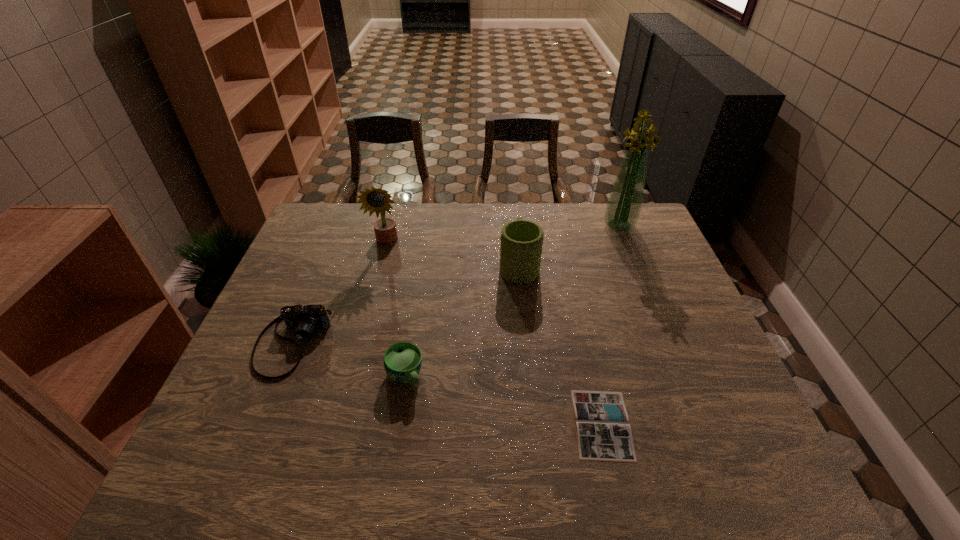
At what (x,y) coordinates should I click in order to perform the action: click on free space between the tallest object and the fourth shortest object. Please return your answer as a coordinate pair (x, y). Looking at the image, I should click on (569, 245).

The image size is (960, 540). Find the location of `free point between the cup and the second object from left to right`. free point between the cup and the second object from left to right is located at coordinates (396, 310).

Identify the location of free space between the third tallest object and the shortest object. The width and height of the screenshot is (960, 540). (561, 345).

The width and height of the screenshot is (960, 540). Identify the location of vacant area between the leftmost object and the book. (447, 383).

Find the location of a particular element. The width and height of the screenshot is (960, 540). unoccupied area between the fourth object from left to right and the cup is located at coordinates (462, 321).

Where is `unoccupied position between the third object from left to right and the shortest object`? unoccupied position between the third object from left to right and the shortest object is located at coordinates (503, 400).

At what (x,y) coordinates should I click in order to perform the action: click on free space between the leftmost object and the fifth object from right to left. Please return your answer as a coordinate pair (x, y). Looking at the image, I should click on (340, 293).

You are a GUI agent. You are given a task and a screenshot of the screen. Output one action in this format:
    pyautogui.click(x=<x>, y=<y>)
    Task: Click on the free space between the third object from left to right and the leftmost object
    Image resolution: width=960 pixels, height=540 pixels.
    Given the screenshot: What is the action you would take?
    pyautogui.click(x=348, y=360)

Find the location of a particular element. The image size is (960, 540). empty space between the cup and the sunflower is located at coordinates (396, 310).

Choose which object is the fourth nearest neighbor to the bouquet. Please provide its 2D coordinates. Your answer should be formatted as a tuple, i.e. [(x, y)], where the tuple contains the x and y coordinates of a point satisfying the conditions above.

[(402, 361)]